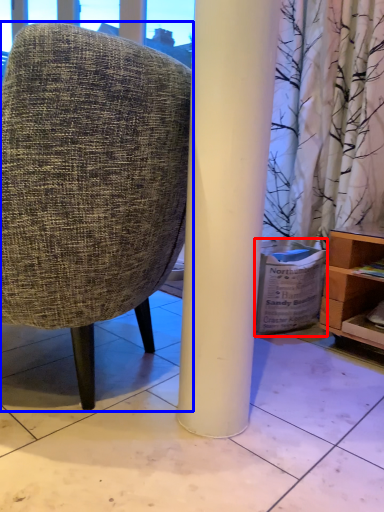
Question: Which object is further to the camera taking this photo, cardboard box (highlighted by a red box) or chair (highlighted by a blue box)?

Choices:
 (A) cardboard box
 (B) chair

Answer: (A)